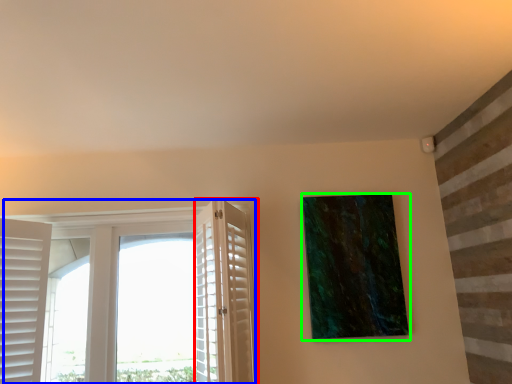
Question: Which is farther away from screen door (highlighted by a red box)? window (highlighted by a blue box) or picture frame (highlighted by a green box)?

Choices:
 (A) window
 (B) picture frame

Answer: (A)